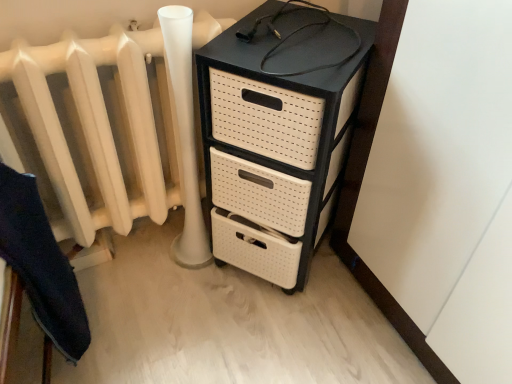
Question: Is white matte radiator at left located outside black plastic chest of drawers at upper right?

Choices:
 (A) no
 (B) yes

Answer: (B)

Question: From a real-world perspective, is white matte radiator at left on black plastic chest of drawers at upper right?

Choices:
 (A) yes
 (B) no

Answer: (A)

Question: From the image's perspective, is white matte radiator at left below black plastic chest of drawers at upper right?

Choices:
 (A) yes
 (B) no

Answer: (B)

Question: Is white matte radiator at left looking in the opposite direction of black plastic chest of drawers at upper right?

Choices:
 (A) no
 (B) yes

Answer: (A)

Question: Can you confirm if white matte radiator at left is wider than black plastic chest of drawers at upper right?

Choices:
 (A) yes
 (B) no

Answer: (B)

Question: Considering the positions of black plastic chest of drawers at upper right and white matte radiator at left in the image, is black plastic chest of drawers at upper right bigger or smaller than white matte radiator at left?

Choices:
 (A) big
 (B) small

Answer: (A)

Question: Looking at their shapes, would you say black plastic chest of drawers at upper right is wider or thinner than white matte radiator at left?

Choices:
 (A) wide
 (B) thin

Answer: (A)

Question: Is black plastic chest of drawers at upper right to the left or to the right of white matte radiator at left in the image?

Choices:
 (A) right
 (B) left

Answer: (A)

Question: From the image's perspective, is black plastic chest of drawers at upper right located above or below white matte radiator at left?

Choices:
 (A) below
 (B) above

Answer: (A)

Question: From their relative heights in the image, would you say dark blue fabric at lower left is taller or shorter than black plastic chest of drawers at upper right?

Choices:
 (A) short
 (B) tall

Answer: (A)

Question: Is point (42, 258) positioned closer to the camera than point (265, 21)?

Choices:
 (A) closer
 (B) farther

Answer: (A)

Question: Based on their positions, is dark blue fabric at lower left located to the left or right of black plastic chest of drawers at upper right?

Choices:
 (A) right
 (B) left

Answer: (B)

Question: Which is correct: dark blue fabric at lower left is inside black plastic chest of drawers at upper right, or outside of it?

Choices:
 (A) inside
 (B) outside

Answer: (B)

Question: From a real-world perspective, is white matte radiator at left physically located above or below black plastic chest of drawers at upper right?

Choices:
 (A) below
 (B) above

Answer: (B)

Question: Is white matte radiator at left taller or shorter than black plastic chest of drawers at upper right?

Choices:
 (A) tall
 (B) short

Answer: (B)